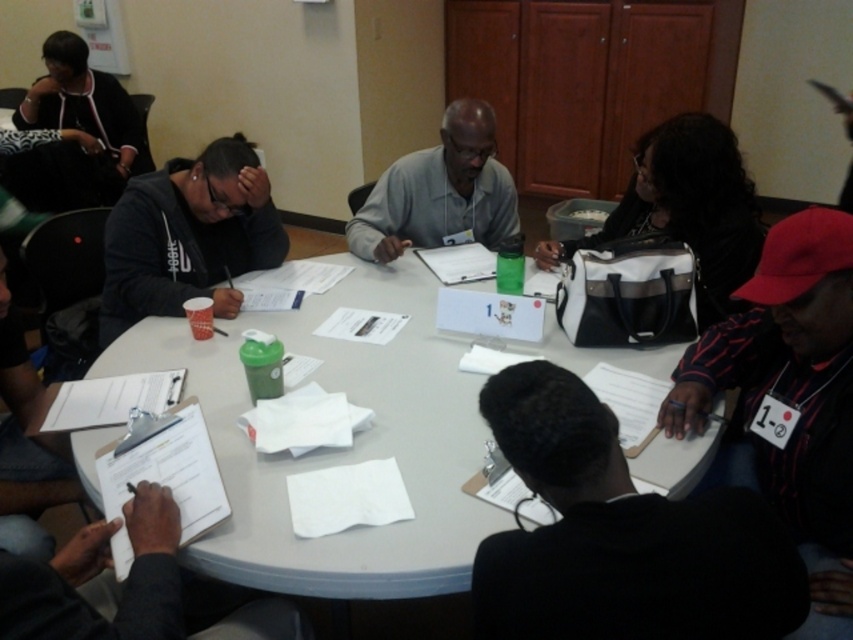
You are a photographer standing to the side of the table. You need to take a photo that includes both the matte black hoodie at left and the gray matte shirt at center. Which direction should you move to ensure both are in frame?

Since the matte black hoodie at left is to the left of the gray matte shirt at center, you should move to the left side of the table to ensure both are in frame.

You are a participant in the meeting and need to retrieve your matte black hoodie at left and matte black jacket at upper left. Which one is closer to the edge of the table?

The matte black hoodie at left is closer to the edge of the table because it is positioned below the matte black jacket at upper left, which places it lower and nearer to the table edge.